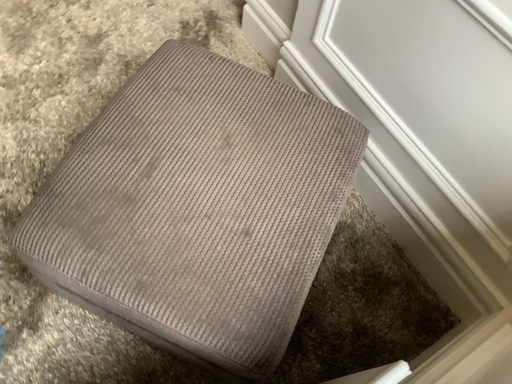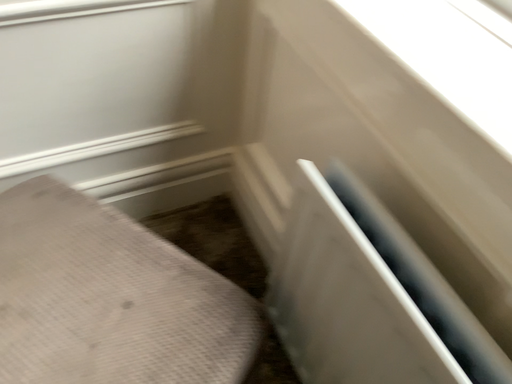
Question: Which way did the camera rotate in the video?

Choices:
 (A) rotated upward
 (B) rotated downward

Answer: (A)